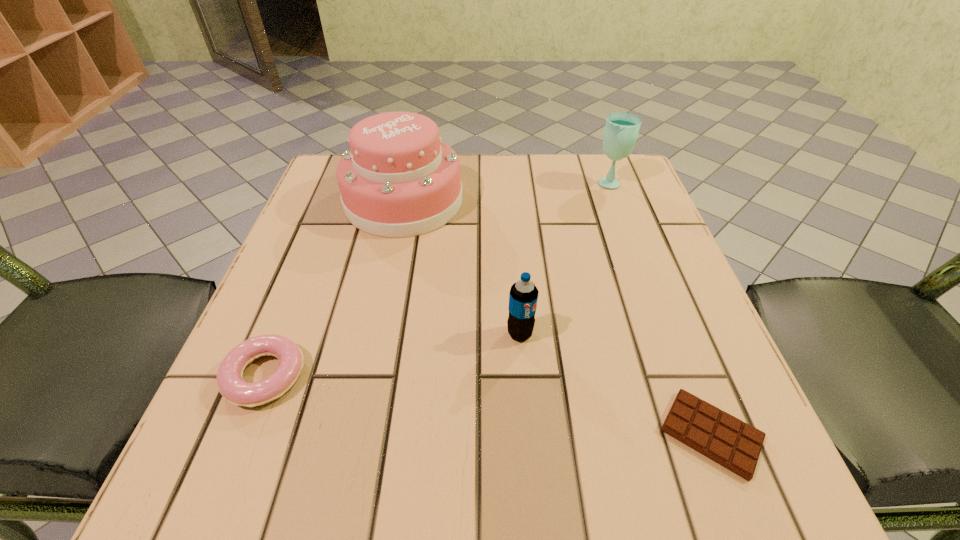
Find the location of a particular element. Image resolution: width=960 pixels, height=540 pixels. vacant space that satisfies the following two spatial constraints: 1. on the front side of the doughnut; 2. on the right side of the shortest object is located at coordinates (242, 434).